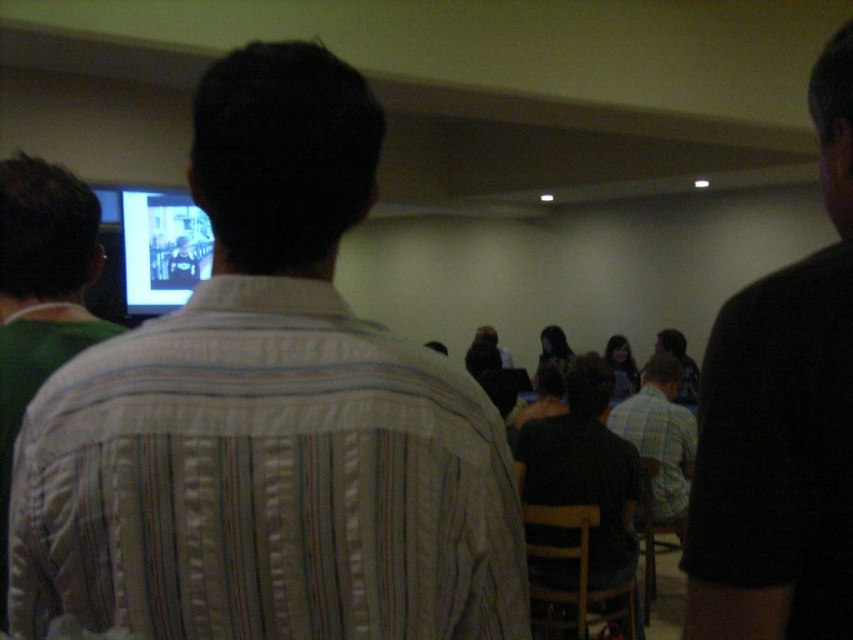
You are standing in the room and want to see the screen clearly. The white striped shirt at center is blocking your view. Based on its position, which direction should you move to get a better view of the screen?

Since the white striped shirt at center is located at point 0.653 on the x and 0.315 on the y coordinates, you should move to the left to get a better view of the screen.

From the picture: You are organizing a photo shoot and need to place two models in the scene described. The black matte shirt at right and the plaid cotton shirt at center must be positioned such that their sizes are consistent with the original image. Which model should stand closer to the camera to maintain the size relationship shown?

The black matte shirt at right has a smaller size compared to the plaid cotton shirt at center, so to maintain this size relationship, the model wearing the black matte shirt at right should stand closer to the camera than the model wearing the plaid cotton shirt at center.

You are an attendee at this presentation. You notice two people in the front row wearing a black matte shirt at right and a plaid cotton shirt at center. If you want to pass between them to get to the exit behind them, which direction should you move towards?

The black matte shirt at right is located above plaid cotton shirt at center, meaning they are stacked vertically. To pass between them, you should move towards the side opposite of the plaid cotton shirt at center since they are not side by side but one is positioned higher than the other.